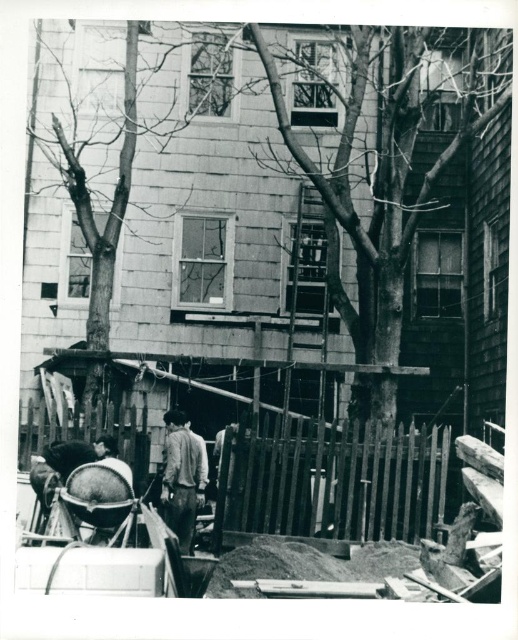
Question: Which object appears farthest from the camera in this image?

Choices:
 (A) bare wood tree at center
 (B) light brown leather jacket at center
 (C) wooden picket fence at lower center

Answer: (A)

Question: Which point is closer to the camera?

Choices:
 (A) (93, 364)
 (B) (169, 483)

Answer: (B)

Question: Based on their relative distances, which object is nearer to the light brown leather jacket at center?

Choices:
 (A) bare wood tree at center
 (B) wooden picket fence at lower center

Answer: (B)

Question: Is bare wood tree at center in front of light brown leather jacket at center?

Choices:
 (A) no
 (B) yes

Answer: (A)

Question: Does wooden picket fence at lower center come behind light brown leather jacket at center?

Choices:
 (A) yes
 (B) no

Answer: (B)

Question: Observing the image, what is the correct spatial positioning of wooden picket fence at lower center in reference to bare wood tree at center?

Choices:
 (A) below
 (B) above

Answer: (A)